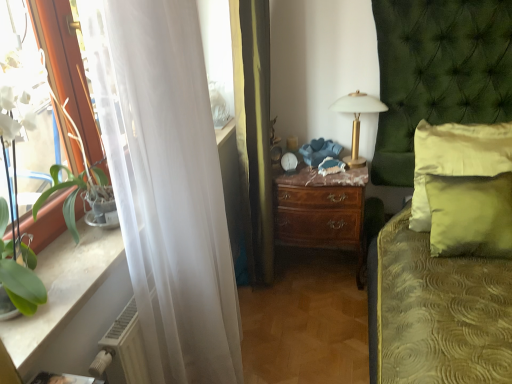
Question: From the image's perspective, is green satin pillow at right, acting as the second pillow starting from the front, located above or below green textured bed at center?

Choices:
 (A) above
 (B) below

Answer: (A)

Question: Choose the correct answer: Is green satin pillow at right, the first pillow positioned from the back, inside green textured bed at center or outside it?

Choices:
 (A) outside
 (B) inside

Answer: (B)

Question: Based on their relative distances, which object is farther from the gold metallic table lamp at upper center?

Choices:
 (A) brown wood nightstand at center
 (B) white sheer curtain at left
 (C) green satin pillow at right, acting as the second pillow starting from the front
 (D) green fabric pillow at right, positioned as the 2th pillow in back-to-front order
 (E) green textured bed at center

Answer: (B)

Question: Estimate the real-world distances between objects in this image. Which object is farther from the gold metallic table lamp at upper center?

Choices:
 (A) green satin pillow at right, the first pillow positioned from the back
 (B) green fabric pillow at right, marked as the 1th pillow in a front-to-back arrangement
 (C) white sheer curtain at left
 (D) white plastic radiator at lower left
 (E) brown wood nightstand at center

Answer: (D)